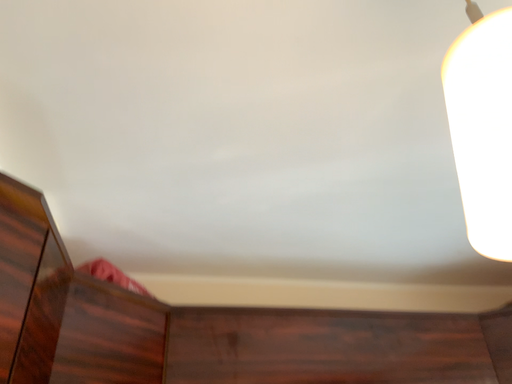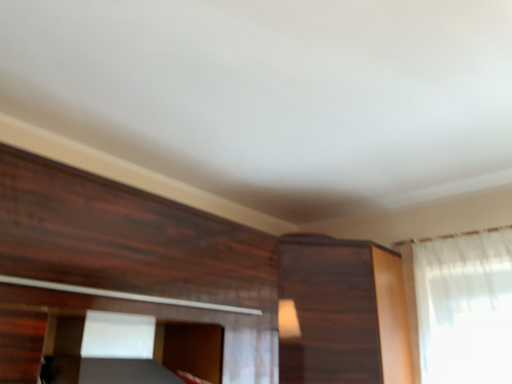
Question: How did the camera likely rotate when shooting the video?

Choices:
 (A) rotated downward
 (B) rotated upward

Answer: (A)